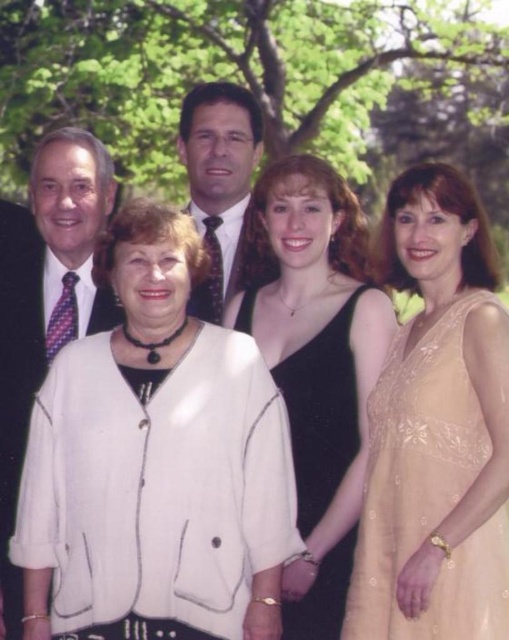
You are standing in front of the group of five people in the image. There are two points marked in the scene, one at coordinate point [208,637] and another at point [214,186]. Which point is closer to you?

Point [208,637] is closer to the viewer than point [214,186].

You are a photographer adjusting the camera settings for a group photo. The scene includes a satin beige dress at right and a matte black suit at center. Which object should you focus on first if you want to ensure both are in sharp focus, considering their sizes?

The satin beige dress at right has a larger size compared to the matte black suit at center, so you should focus on the larger satin beige dress at right first to ensure proper depth of field for both.

From the picture: You are a photographer setting up for a group photo. You have two subjects wearing the white fabric jacket at center and the matte black suit at center. Which subject should you position closer to the camera to ensure their clothing details are clearly visible?

The white fabric jacket at center might be wider than matte black suit at center, so positioning the subject wearing the white fabric jacket at center closer to the camera will ensure their clothing details are clearly visible.